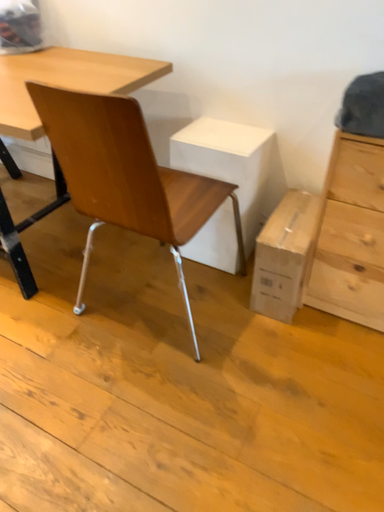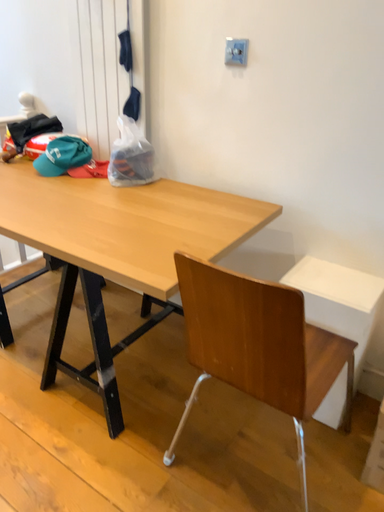
Question: How did the camera likely rotate when shooting the video?

Choices:
 (A) rotated upward
 (B) rotated downward

Answer: (A)